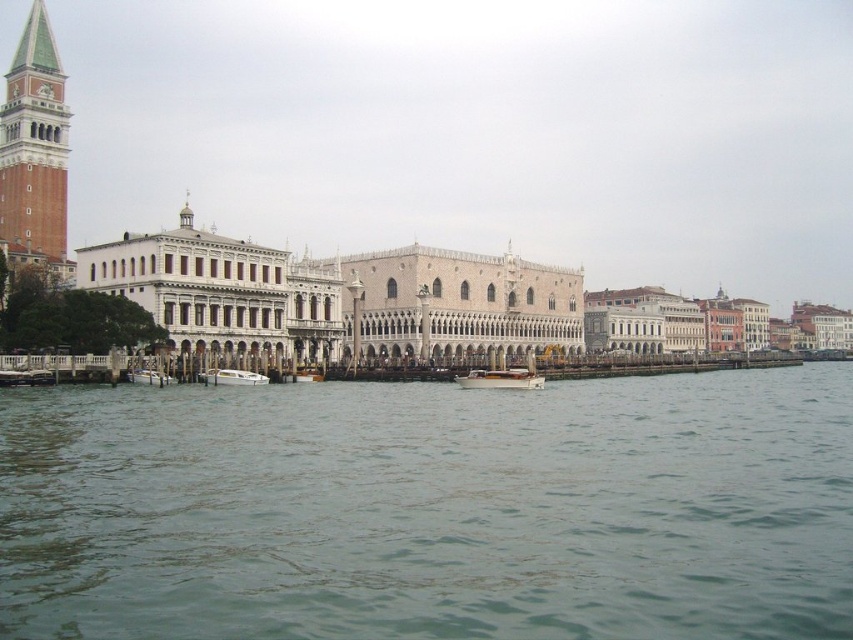
Can you confirm if golden mosaic palace at center is positioned to the right of white matte boat at lower left?

Correct, you'll find golden mosaic palace at center to the right of white matte boat at lower left.

Is golden mosaic palace at center thinner than white matte boat at lower left?

No.

What do you see at coordinates (454, 305) in the screenshot?
I see `golden mosaic palace at center` at bounding box center [454, 305].

I want to click on golden mosaic palace at center, so click(x=454, y=305).

Between point (503, 376) and point (212, 376), which one is positioned in front?

Point (212, 376) is in front.

Is point (466, 387) closer to viewer compared to point (224, 380)?

No, (466, 387) is behind (224, 380).

In order to click on wooden polished boat at center in this screenshot , I will do `click(502, 380)`.

Consider the image. Between golden mosaic palace at center and green-tiled tower at left, which one is positioned lower?

golden mosaic palace at center is lower down.

Find the location of `golden mosaic palace at center`. golden mosaic palace at center is located at coordinates coord(454,305).

What do you see at coordinates (454, 305) in the screenshot?
I see `golden mosaic palace at center` at bounding box center [454, 305].

This screenshot has height=640, width=853. In order to click on golden mosaic palace at center in this screenshot , I will do `click(454, 305)`.